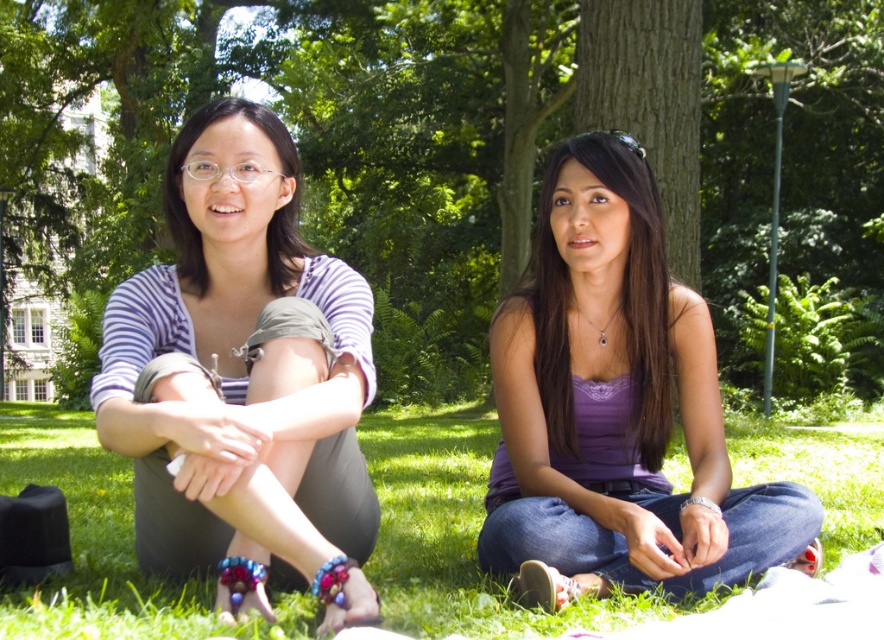
Looking at this image, you are planning to place a small picnic basket on the green grass at lower center. Considering the purple satin top at center is currently occupying some space, will there be enough room for the basket?

The green grass at lower center might be wider than the purple satin top at center, so there is likely enough space to place the picnic basket.

You are planning to place a small bench between the brown textured tree at center and the purple satin top at center. Based on their widths, which object should the bench be closer to?

The bench should be closer to the purple satin top at center because the brown textured tree at center is wider than the purple satin top at center, so positioning the bench closer to the narrower object allows for better balance.